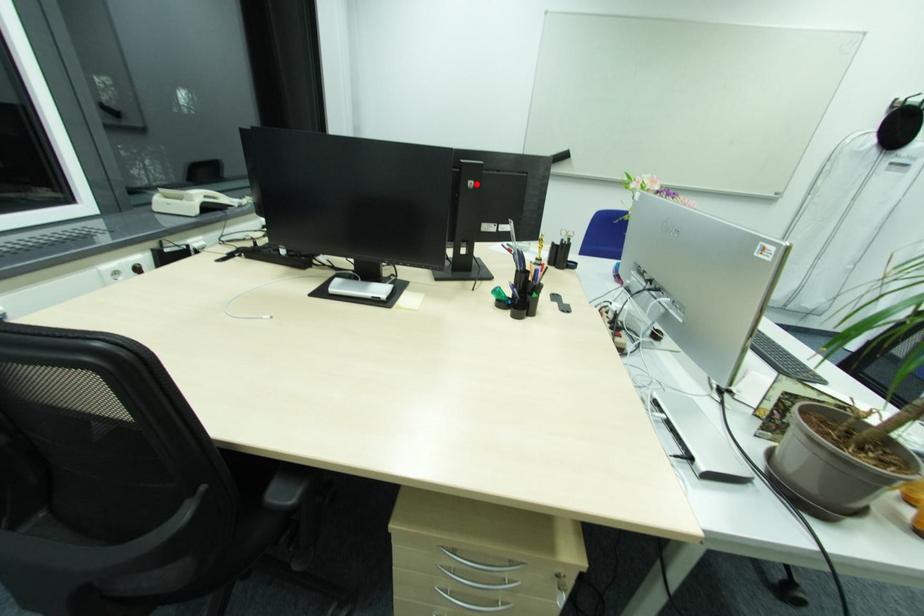
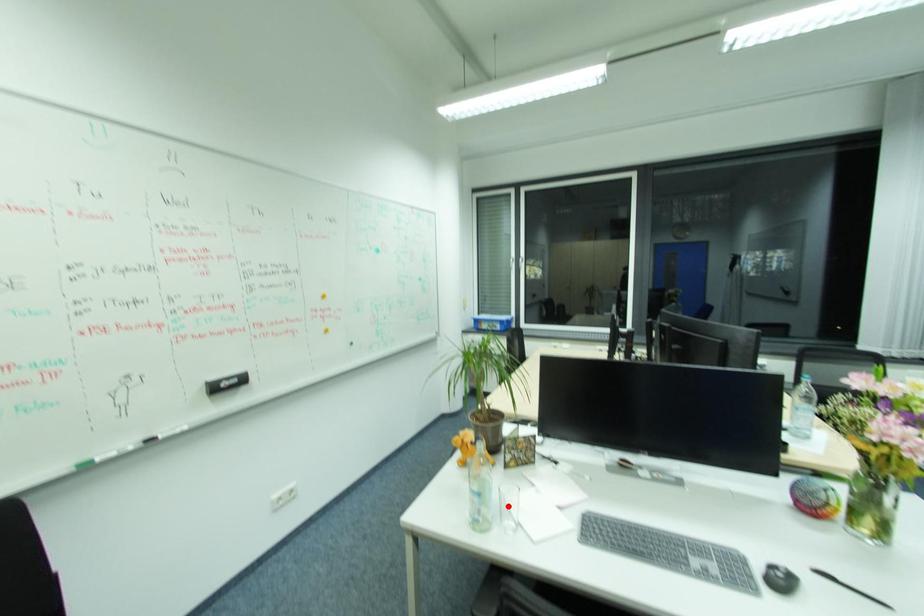
I am providing you with two images of the same scene from different viewpoints. A red point is marked on the first image and another point is marked on the second image. Do the highlighted points in image1 and image2 indicate the same real-world spot?

No